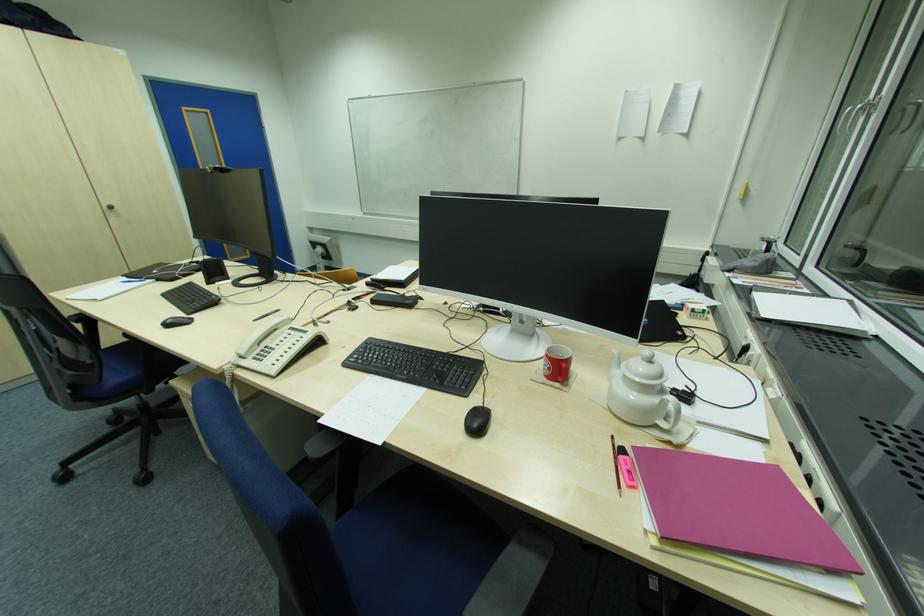
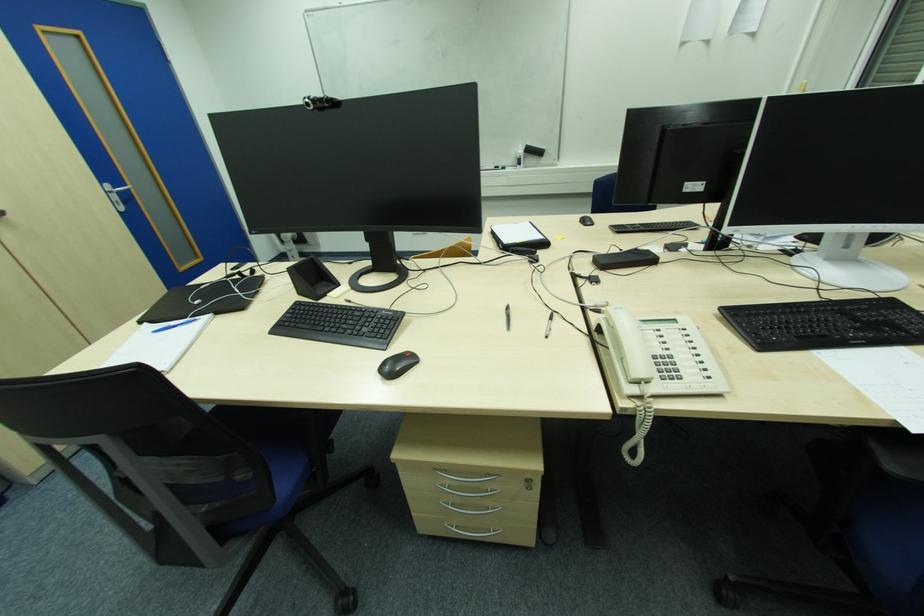
The point at (125, 284) is marked in the first image. Where is the corresponding point in the second image?

(156, 333)